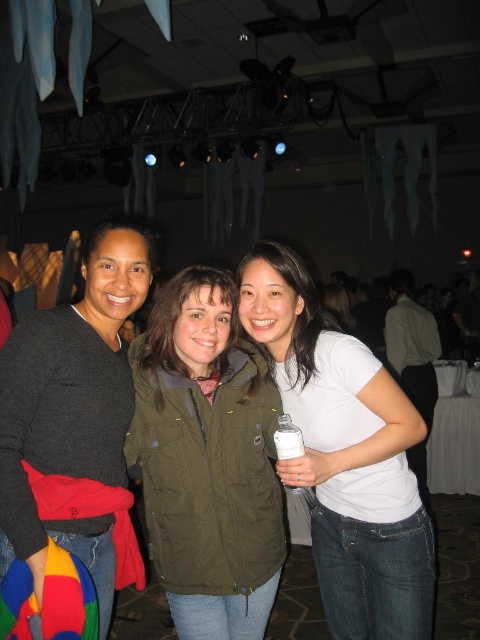
You are a photographer adjusting the lighting for a group photo. You notice the olive green jacket at center and the white matte shirt at center. Which clothing item should you focus on to ensure it stands out more due to its height?

The white matte shirt at center should be focused on because it is taller than the olive green jacket at center, making it more prominent in height.

You are a photographer setting up for a group photo. You need to ensure that the olive green jacket at center and the dark gray sweater at center are both fully visible in the frame. Based on their positions and sizes, which clothing item might require more space to accommodate its width?

The olive green jacket at center might require more space to accommodate its width since it is wider than the dark gray sweater at center.